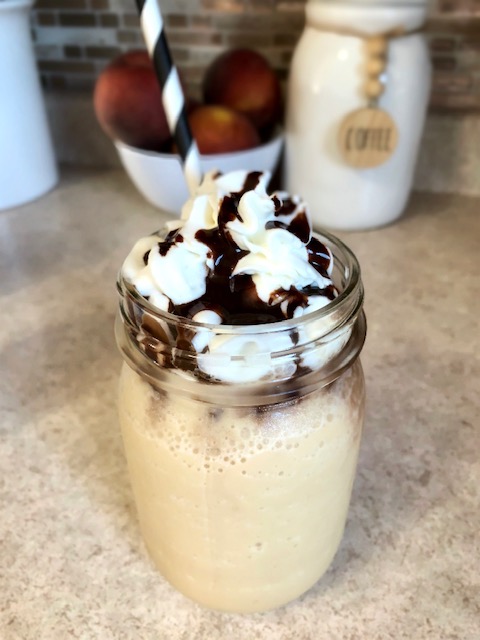
You are a GUI agent. You are given a task and a screenshot of the screen. Output one action in this format:
    pyautogui.click(x=<x>, y=<y>)
    Task: Click on the bowl
    
    Given the screenshot: What is the action you would take?
    pyautogui.click(x=164, y=173)